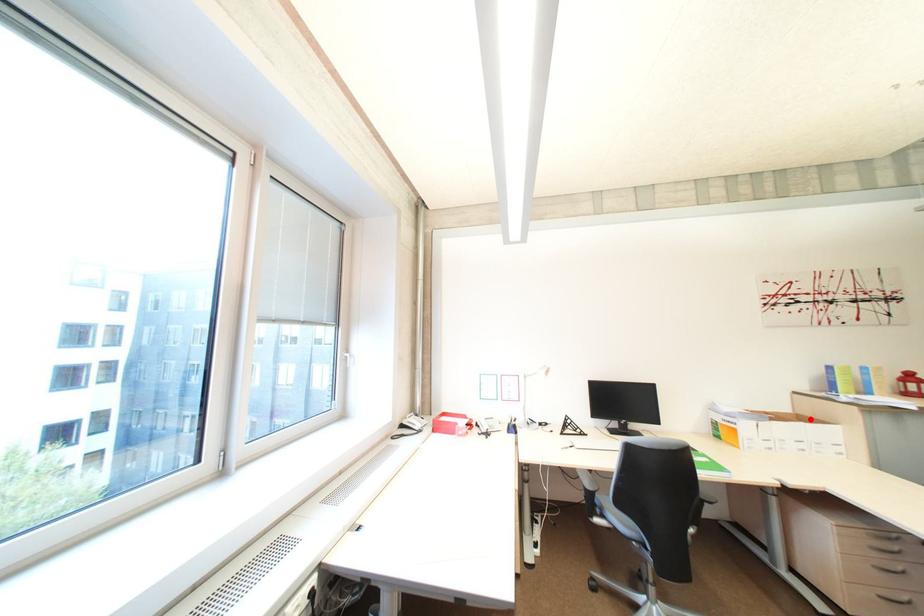
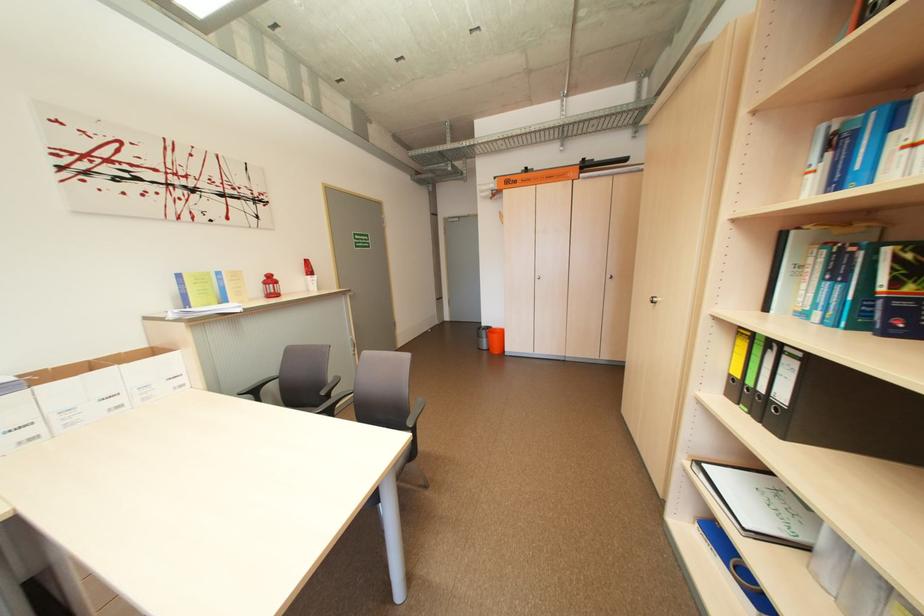
Question: I am providing you with two images of the same scene from different viewpoints. A red point is marked on the first image. Can you still see the location of the red point in image 2?

Choices:
 (A) Yes
 (B) No

Answer: (A)